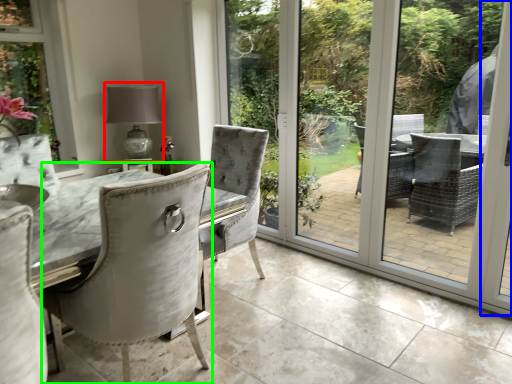
Question: Considering the real-world distances, which object is farthest from table lamp (highlighted by a red box)? screen door (highlighted by a blue box) or chair (highlighted by a green box)?

Choices:
 (A) screen door
 (B) chair

Answer: (A)